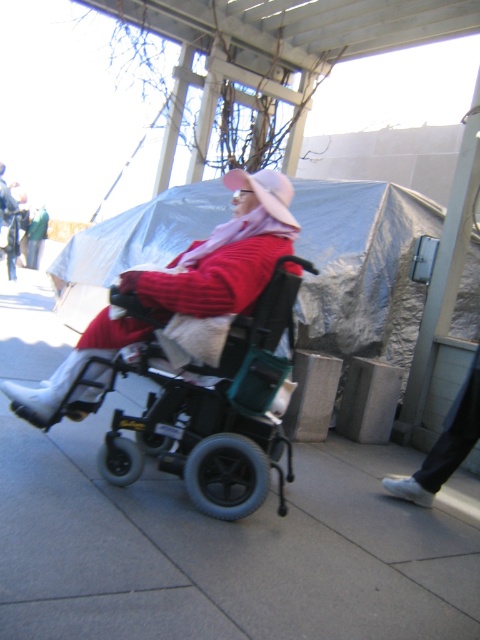
Question: Which of these objects is positioned closest to the gray concrete pavement at center?

Choices:
 (A) black plastic wheelchair at center
 (B) matte pink sweater at center

Answer: (A)

Question: Can you confirm if gray concrete pavement at center is positioned below black plastic wheelchair at center?

Choices:
 (A) yes
 (B) no

Answer: (A)

Question: Which point is closer to the camera?

Choices:
 (A) (166, 632)
 (B) (160, 368)

Answer: (A)

Question: Does gray concrete pavement at center have a smaller size compared to black plastic wheelchair at center?

Choices:
 (A) yes
 (B) no

Answer: (B)

Question: Is gray concrete pavement at center bigger than matte pink sweater at center?

Choices:
 (A) no
 (B) yes

Answer: (B)

Question: Among these objects, which one is nearest to the camera?

Choices:
 (A) matte pink sweater at center
 (B) gray concrete pavement at center

Answer: (B)